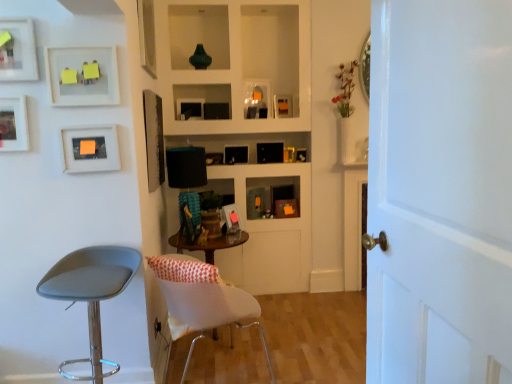
Question: Is matte white picture frame at upper left, acting as the 2th picture frame starting from the front, positioned beyond the bounds of matte black picture frame at center, arranged as the 6th picture frame when viewed from the front?

Choices:
 (A) no
 (B) yes

Answer: (B)

Question: Does matte white picture frame at upper left, acting as the 2th picture frame starting from the front, have a greater width compared to matte black picture frame at center, arranged as the 6th picture frame when viewed from the front?

Choices:
 (A) no
 (B) yes

Answer: (A)

Question: Is matte white picture frame at upper left, which is the ninth picture frame in back-to-front order, touching matte black picture frame at center, arranged as the 6th picture frame when viewed from the front?

Choices:
 (A) no
 (B) yes

Answer: (A)

Question: Considering the relative sizes of matte white picture frame at upper left, which is the ninth picture frame in back-to-front order, and matte black picture frame at center, placed as the fifth picture frame when sorted from back to front, in the image provided, is matte white picture frame at upper left, which is the ninth picture frame in back-to-front order, taller than matte black picture frame at center, placed as the fifth picture frame when sorted from back to front,?

Choices:
 (A) yes
 (B) no

Answer: (B)

Question: Can you confirm if matte white picture frame at upper left, acting as the 2th picture frame starting from the front, is thinner than matte black picture frame at center, arranged as the 6th picture frame when viewed from the front?

Choices:
 (A) yes
 (B) no

Answer: (A)

Question: In terms of size, does green glossy vase at upper center appear bigger or smaller than matte black picture frame at upper center, which ranks as the 1th picture frame in back-to-front order?

Choices:
 (A) big
 (B) small

Answer: (A)

Question: From the image's perspective, is green glossy vase at upper center located above or below matte black picture frame at upper center, which appears as the tenth picture frame when viewed from the front?

Choices:
 (A) above
 (B) below

Answer: (A)

Question: Considering their positions, is green glossy vase at upper center located in front of or behind matte black picture frame at upper center, which ranks as the 1th picture frame in back-to-front order?

Choices:
 (A) behind
 (B) front

Answer: (B)

Question: Is green glossy vase at upper center situated inside matte black picture frame at upper center, which appears as the tenth picture frame when viewed from the front, or outside?

Choices:
 (A) inside
 (B) outside

Answer: (B)

Question: Is white fabric desk at center in front of or behind matte black picture frame at center, the fourth picture frame from the back, in the image?

Choices:
 (A) behind
 (B) front

Answer: (B)

Question: Considering the positions of white fabric desk at center and matte black picture frame at center, the fourth picture frame from the back, in the image, is white fabric desk at center taller or shorter than matte black picture frame at center, the fourth picture frame from the back,?

Choices:
 (A) tall
 (B) short

Answer: (A)

Question: Is point pos(176,238) closer or farther from the camera than point pos(231,210)?

Choices:
 (A) farther
 (B) closer

Answer: (B)

Question: Considering the positions of white fabric desk at center and matte black picture frame at center, the fourth picture frame from the back, in the image, is white fabric desk at center bigger or smaller than matte black picture frame at center, the fourth picture frame from the back,?

Choices:
 (A) big
 (B) small

Answer: (A)

Question: In terms of width, does gray leather stool at left, the 2th chair when ordered from right to left, look wider or thinner when compared to matte black picture frame at center, the fourth picture frame from the back?

Choices:
 (A) wide
 (B) thin

Answer: (A)

Question: Is gray leather stool at left, which is counted as the first chair, starting from the left, spatially inside matte black picture frame at center, the fourth picture frame from the back, or outside of it?

Choices:
 (A) outside
 (B) inside

Answer: (A)